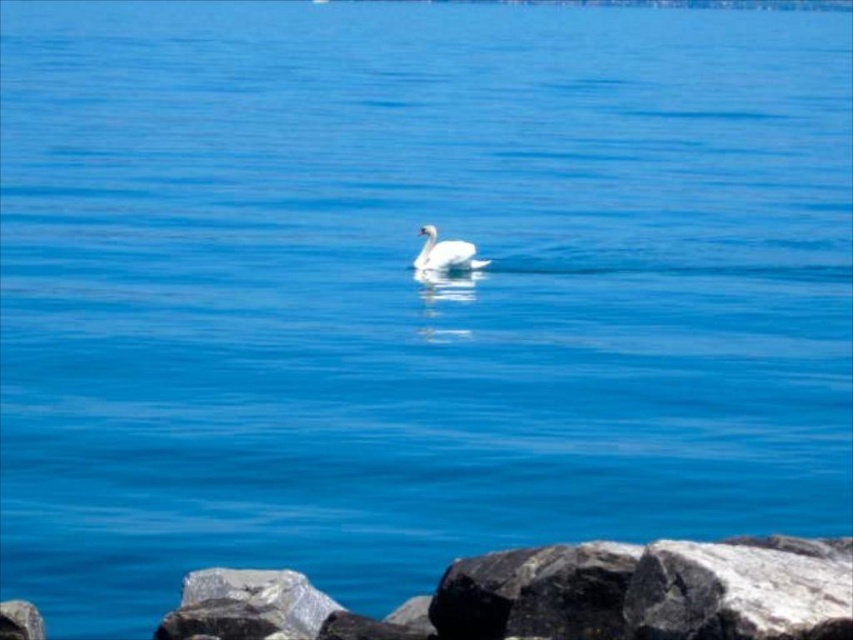
Is gray rock at lower center taller than white glossy swan at center?

In fact, gray rock at lower center may be shorter than white glossy swan at center.

Can you confirm if gray rock at lower center is smaller than white glossy swan at center?

Correct, gray rock at lower center occupies less space than white glossy swan at center.

I want to click on gray rock at lower center, so click(247, 605).